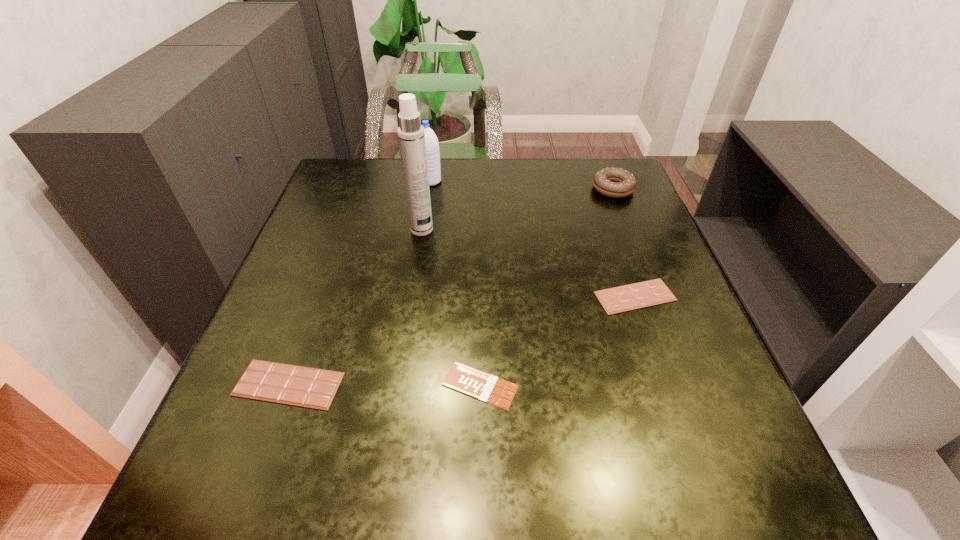
Find the location of `free space located 0.260m on the right of the water bottle`. free space located 0.260m on the right of the water bottle is located at coordinates (533, 181).

Locate an element on the screen. The height and width of the screenshot is (540, 960). free location located on the left of the fourth shortest object is located at coordinates (531, 189).

Where is `vacant point located on the right of the leftmost chocolate bar`? This screenshot has height=540, width=960. vacant point located on the right of the leftmost chocolate bar is located at coordinates (489, 384).

Identify the location of vacant space located on the front of the farthest chocolate bar. The width and height of the screenshot is (960, 540). (678, 420).

The height and width of the screenshot is (540, 960). I want to click on vacant space located 0.360m on the right of the fourth object from left to right, so click(x=722, y=385).

Locate an element on the screen. This screenshot has width=960, height=540. water bottle that is at the far edge is located at coordinates (431, 141).

Find the location of `doughnut situated at the far edge`. doughnut situated at the far edge is located at coordinates (613, 182).

Where is `object that is at the left edge`? The width and height of the screenshot is (960, 540). object that is at the left edge is located at coordinates (301, 386).

You are a GUI agent. You are given a task and a screenshot of the screen. Output one action in this format:
    pyautogui.click(x=<x>, y=<y>)
    Task: Click on the doughnut that is at the right edge
    The image size is (960, 540).
    Given the screenshot: What is the action you would take?
    613,182

Locate an element on the screen. This screenshot has height=540, width=960. chocolate bar present at the right edge is located at coordinates [x=620, y=299].